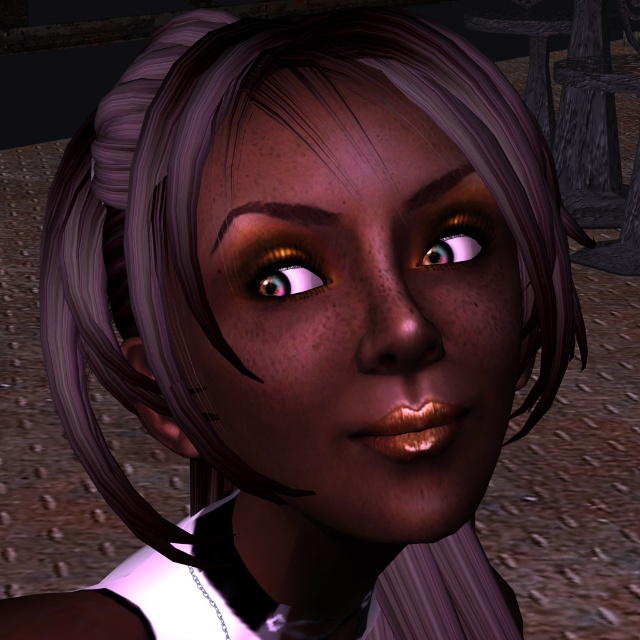
You are an artist analyzing the facial features of the character. Which object has a smaller height between the shiny brown eye at upper right and the brown matte eyebrow at upper center?

The shiny brown eye at upper right has a lesser height compared to the brown matte eyebrow at upper center.

You are a photographer adjusting your camera to focus on the matte skin face at center and the shiny gold eye at center in the image. Which object should you focus on first to ensure proper depth of field?

The matte skin face at center is closer to the viewer than the shiny gold eye at center, so you should focus on the matte skin face at center first to ensure proper depth of field.